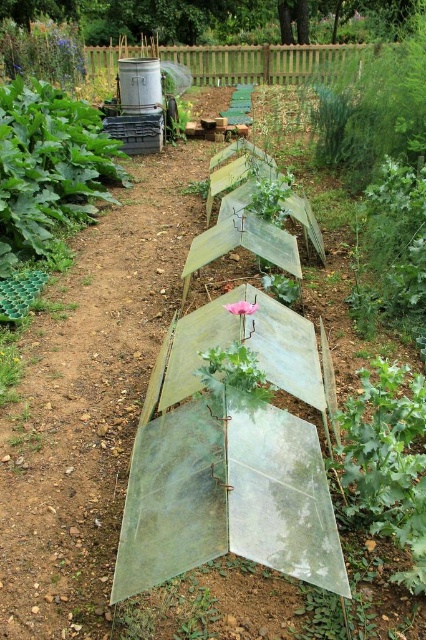
You are standing in the garden and want to place a new plant exactly at the center of the transparent plastic sheet at center. Where should you place it?

The transparent plastic sheet at center is located at point 2D coordinates of (89, 403), so you should place the new plant exactly at those coordinates.

You are a gardener who wants to protect your plants from frost. You have a transparent plastic sheet at center and a green leafy plant at upper left. Which of these can you cover completely with the other?

Answer: The transparent plastic sheet at center is smaller than the green leafy plant at upper left, so it cannot fully cover it. Therefore, you cannot cover the green leafy plant at upper left completely with the transparent plastic sheet at center.

You are standing in the garden and want to place a small statue between the two points, point 1 at point (x=69, y=170) and point 2 at point (x=380, y=516). Which point should the statue be closer to if you want it to be closer to the viewer?

The statue should be placed closer to point 1 at point (x=69, y=170) because it is closer to the viewer compared to point 2 at point (x=380, y=516).